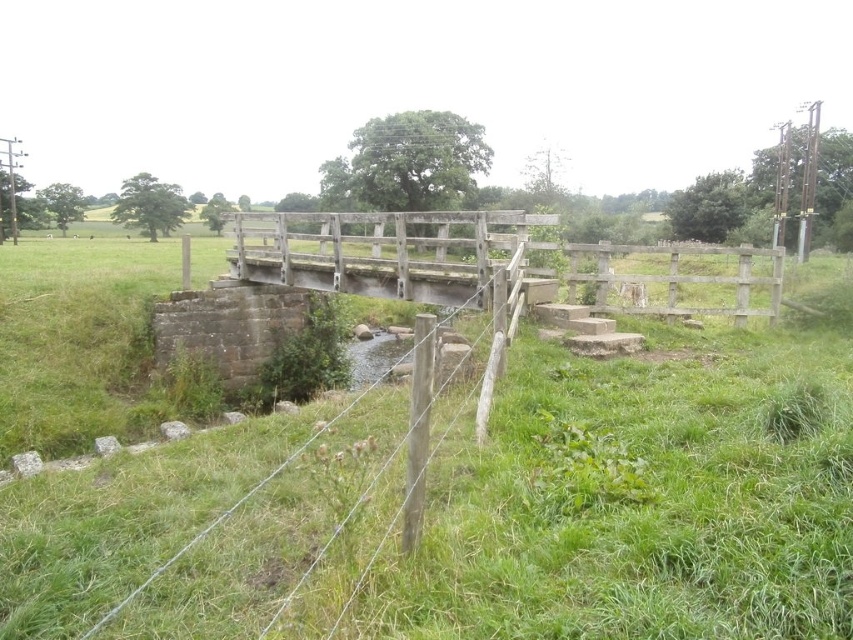
Question: Which point appears closest to the camera in this image?

Choices:
 (A) (508, 522)
 (B) (554, 248)

Answer: (A)

Question: Does green grassy at center lie in front of wooden fence at center?

Choices:
 (A) yes
 (B) no

Answer: (A)

Question: Is green grassy at center in front of wooden fence at center?

Choices:
 (A) no
 (B) yes

Answer: (B)

Question: Does green grassy at center have a larger size compared to wooden fence at center?

Choices:
 (A) yes
 (B) no

Answer: (A)

Question: Which point is farther from the camera taking this photo?

Choices:
 (A) (270, 280)
 (B) (462, 544)

Answer: (A)